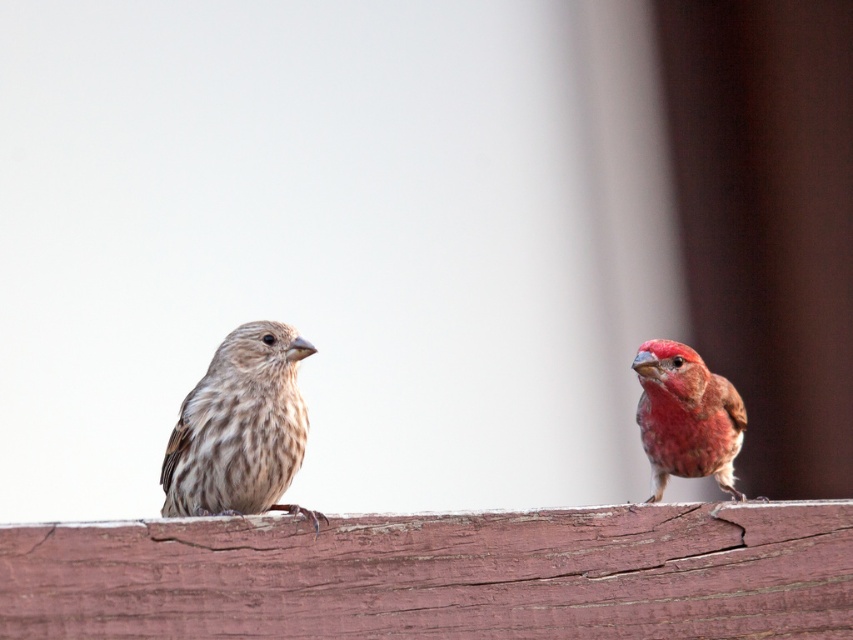
You are a birdwatcher standing at the camera position. You want to observe the brown speckled sparrow at left without disturbing it. If your binoculars have a minimum focus distance of 5 feet, will you be able to clearly see the bird?

The brown speckled sparrow at left is 4.76 feet away from the camera. Since the binoculars require a minimum focus distance of 5 feet, you are too close to use them effectively. You might need to move back slightly to achieve a clear view.